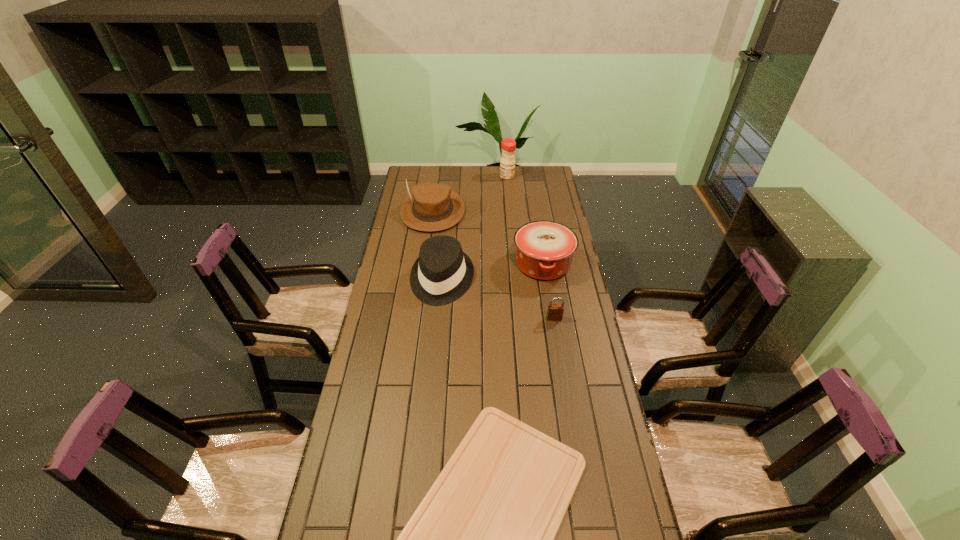
Where is `free region located 0.200m on the back of the nearer fedora`? This screenshot has height=540, width=960. free region located 0.200m on the back of the nearer fedora is located at coordinates (446, 229).

Where is `vacant space located 0.160m on the front-facing side of the padlock`? vacant space located 0.160m on the front-facing side of the padlock is located at coordinates (561, 356).

This screenshot has width=960, height=540. What are the coordinates of `object that is at the far edge` in the screenshot? It's located at (508, 145).

Where is `casserole that is at the right edge`? casserole that is at the right edge is located at coordinates (545, 249).

In order to click on padlock located at the right edge in this screenshot , I will do `click(555, 311)`.

This screenshot has width=960, height=540. In the image, there is a desktop. Identify the location of free region at the far edge. (489, 168).

The image size is (960, 540). In the image, there is a desktop. What are the coordinates of `free space at the left edge` in the screenshot? It's located at (347, 490).

The width and height of the screenshot is (960, 540). I want to click on vacant space at the right edge of the desktop, so click(x=556, y=208).

You are a GUI agent. You are given a task and a screenshot of the screen. Output one action in this format:
    pyautogui.click(x=<x>, y=<y>)
    Task: Click on the vacant space at the far right corner of the desktop
    This screenshot has height=540, width=960.
    Given the screenshot: What is the action you would take?
    pyautogui.click(x=528, y=168)

This screenshot has height=540, width=960. In order to click on empty space between the fifth farthest object and the casserole in this screenshot , I will do `click(549, 291)`.